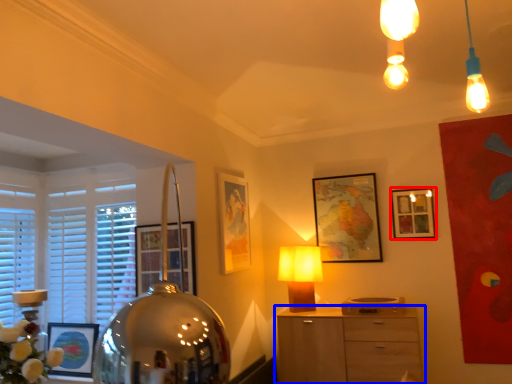
Question: Which point is closer to the camera, picture frame (highlighted by a red box) or chest of drawers (highlighted by a blue box)?

Choices:
 (A) picture frame
 (B) chest of drawers

Answer: (B)